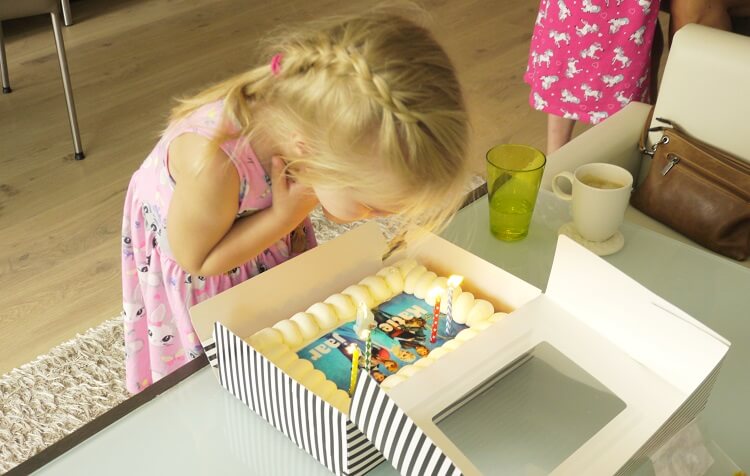
Locate an element on the screen. This screenshot has width=750, height=476. birthday cake is located at coordinates (330, 348).